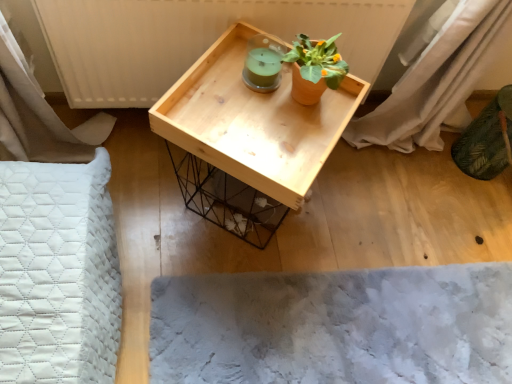
Locate an element on the screen. vacant space that's between natural wood tray at center and fuzzy gray mat at lower center is located at coordinates (336, 232).